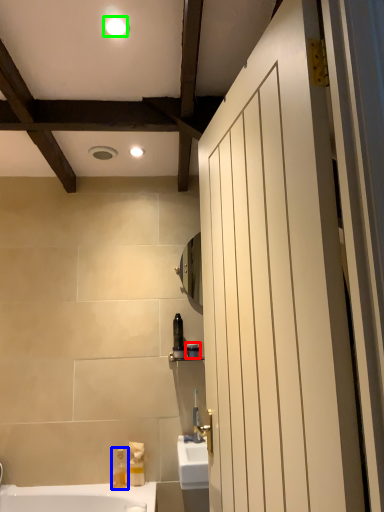
Question: Which object is positioned farthest from toiletry (highlighted by a red box)? Select from soap dispenser (highlighted by a blue box) and light fixture (highlighted by a green box).

Choices:
 (A) soap dispenser
 (B) light fixture

Answer: (B)